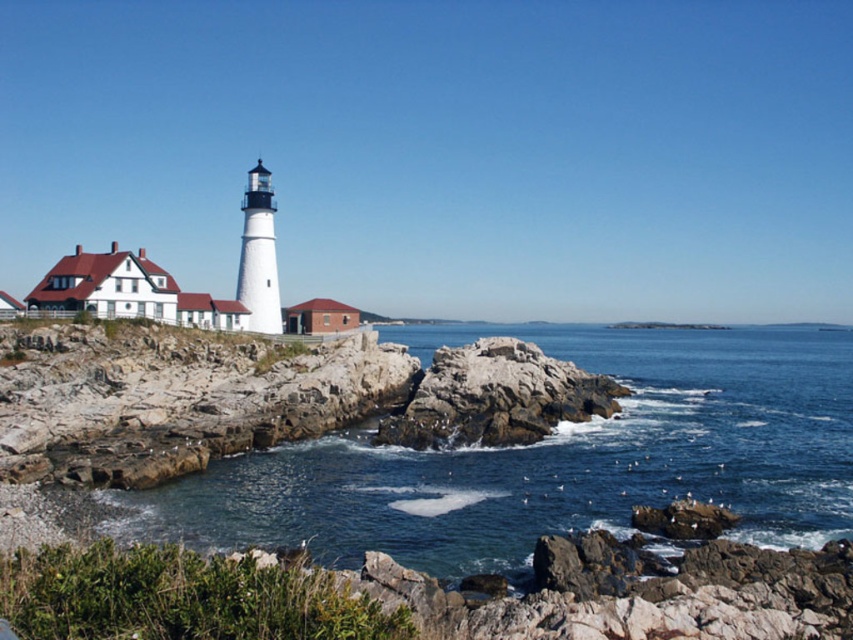
Does clear blue water at center have a lesser height compared to rocky outcrop at center?

No.

Find the location of a particular element. This screenshot has width=853, height=640. clear blue water at center is located at coordinates (553, 458).

Which is in front, point (601, 348) or point (409, 408)?

Point (409, 408) is in front.

Locate an element on the screen. This screenshot has width=853, height=640. clear blue water at center is located at coordinates (553, 458).